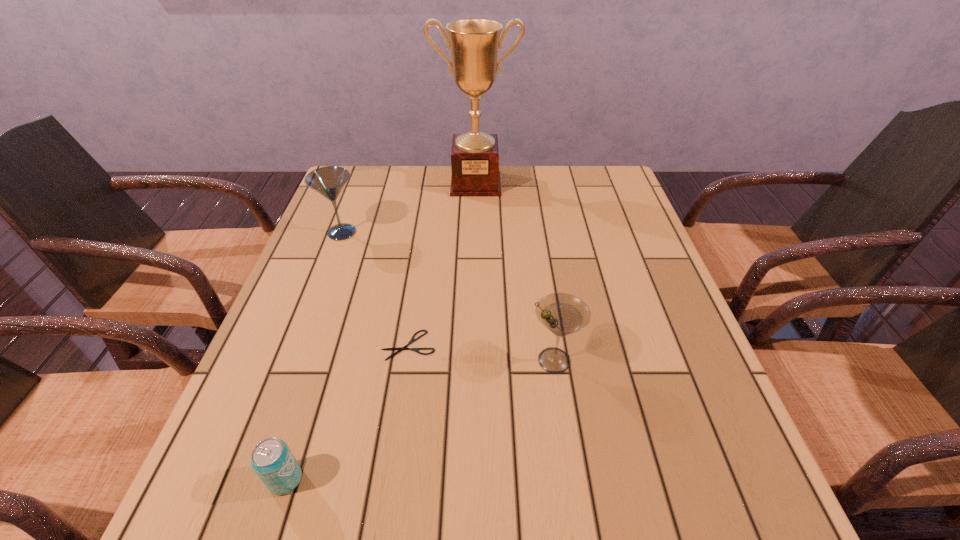
Find the location of a particular element. The height and width of the screenshot is (540, 960). vacant space located on the left of the nearer martini is located at coordinates (499, 360).

Find the location of a particular element. vacant space located 0.350m on the right of the beer can is located at coordinates [513, 479].

Where is `vacant space located on the right of the shortest object`? This screenshot has height=540, width=960. vacant space located on the right of the shortest object is located at coordinates (515, 345).

The width and height of the screenshot is (960, 540). Identify the location of object present at the far edge. (474, 43).

Locate an element on the screen. object located at the near edge is located at coordinates (272, 460).

At what (x,y) coordinates should I click in order to perform the action: click on martini that is at the left edge. Please return your answer as a coordinate pair (x, y). This screenshot has width=960, height=540. Looking at the image, I should click on (329, 181).

I want to click on beer can located in the left edge section of the desktop, so tap(272, 460).

This screenshot has width=960, height=540. Identify the location of object that is at the near left corner. coord(272,460).

Find the location of a particular element. The image size is (960, 540). vacant space at the far edge of the desktop is located at coordinates (456, 199).

Identify the location of free spot at the left edge of the desktop. (320, 302).